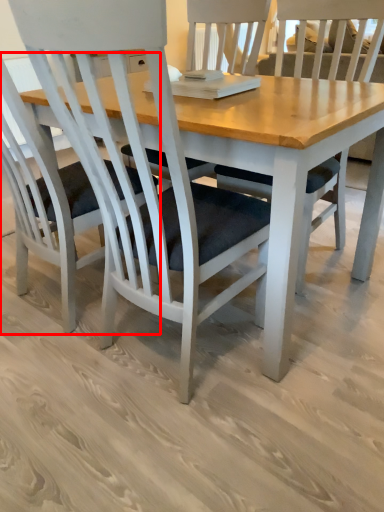
Question: From the image's perspective, what is the correct spatial positioning of chair (annotated by the red box) in reference to chair?

Choices:
 (A) below
 (B) above

Answer: (B)